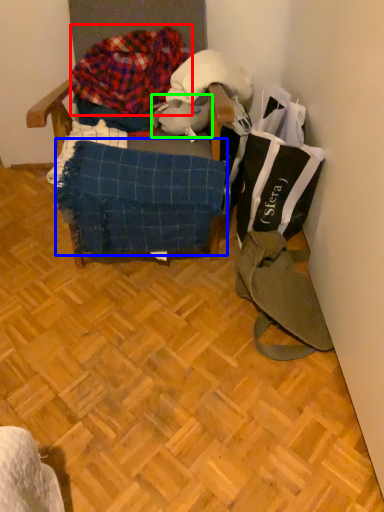
Question: Considering the real-world distances, which object is farthest from waste (highlighted by a red box)? blanket (highlighted by a blue box) or animal (highlighted by a green box)?

Choices:
 (A) blanket
 (B) animal

Answer: (A)